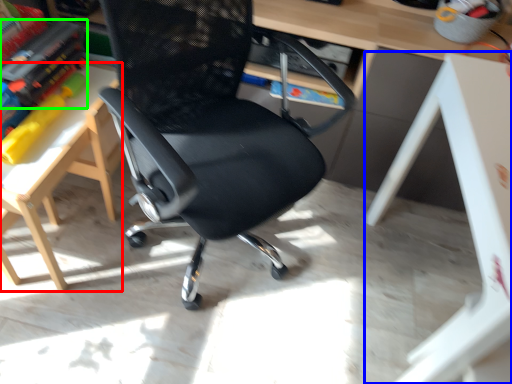
Question: Which object is the farthest from table (highlighted by a red box)? Choose among these: table (highlighted by a blue box) or book (highlighted by a green box).

Choices:
 (A) table
 (B) book

Answer: (A)